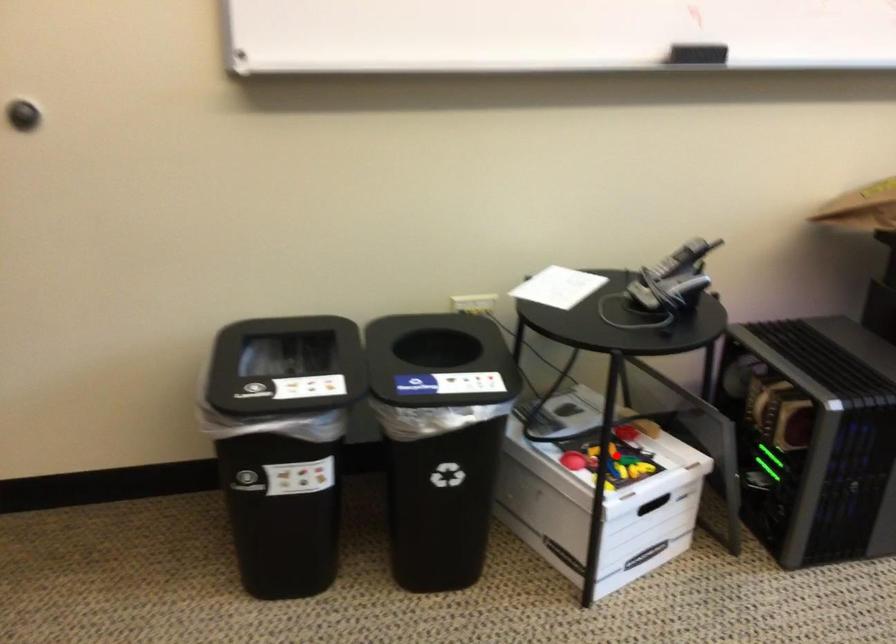
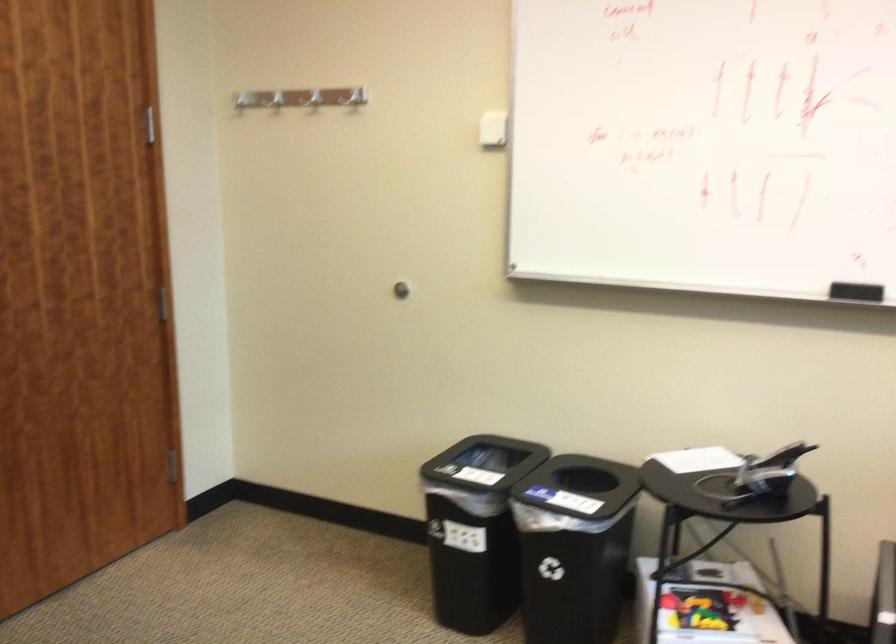
Question: I am providing you with two images of the same scene from different viewpoints. Given a red point in image1, look at the same physical point in image2. Is it:

Choices:
 (A) Closer to the viewpoint
 (B) Farther from the viewpoint

Answer: (B)